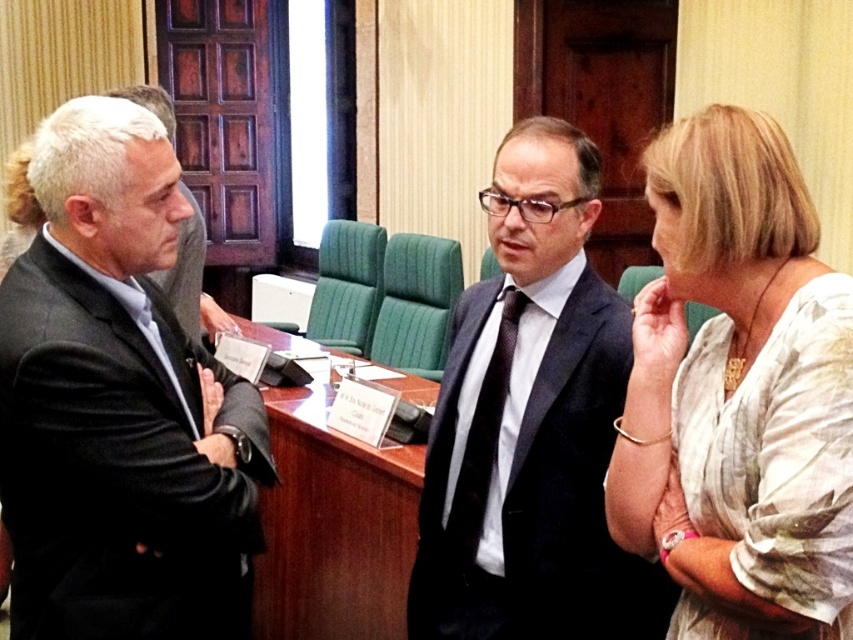
Question: Is the position of dark gray suit at left less distant than that of white textured blouse at center?

Choices:
 (A) no
 (B) yes

Answer: (A)

Question: Does white textured blouse at center have a larger size compared to wooden at center?

Choices:
 (A) yes
 (B) no

Answer: (B)

Question: Is white textured blouse at center to the left of black dotted tie at center from the viewer's perspective?

Choices:
 (A) yes
 (B) no

Answer: (B)

Question: Which point appears closest to the camera in this image?

Choices:
 (A) (479, 528)
 (B) (366, 636)

Answer: (A)

Question: Which of the following is the closest to the observer?

Choices:
 (A) (705, 426)
 (B) (462, 568)
 (C) (271, 428)

Answer: (A)

Question: Which of these objects is positioned farthest from the wooden at center?

Choices:
 (A) dark gray suit at left
 (B) matte black suit at center

Answer: (A)